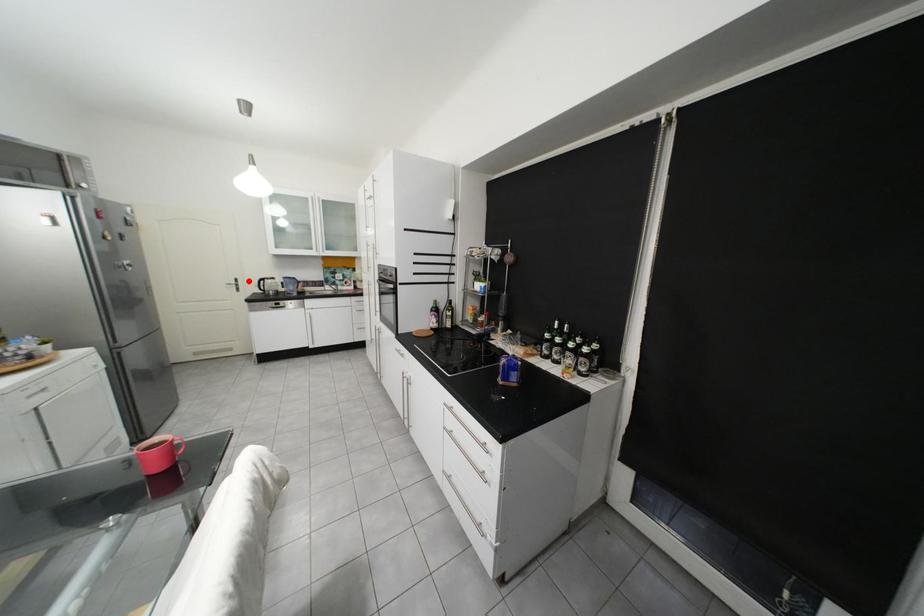
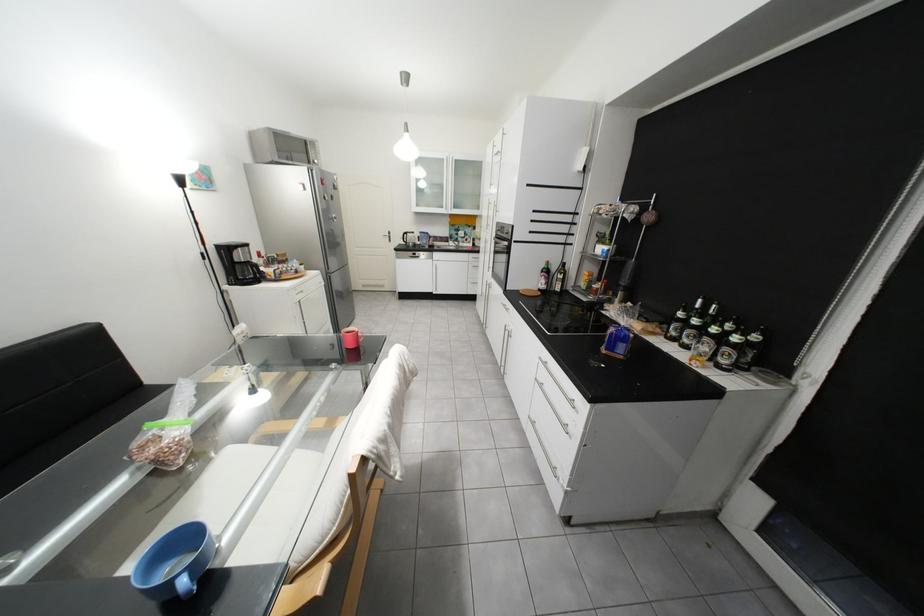
Where in the second image is the point corresponding to the highlighted location from the first image?

(402, 233)